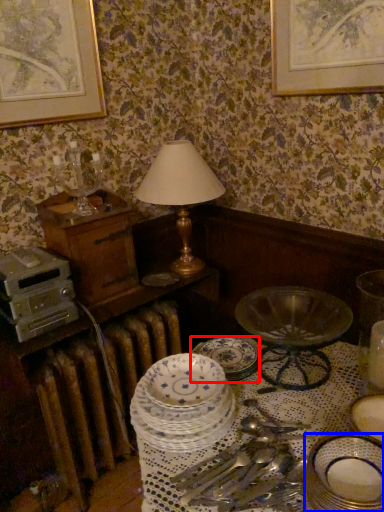
Question: Which object appears closest to the camera in this image, plate (highlighted by a red box) or plate (highlighted by a blue box)?

Choices:
 (A) plate
 (B) plate

Answer: (B)